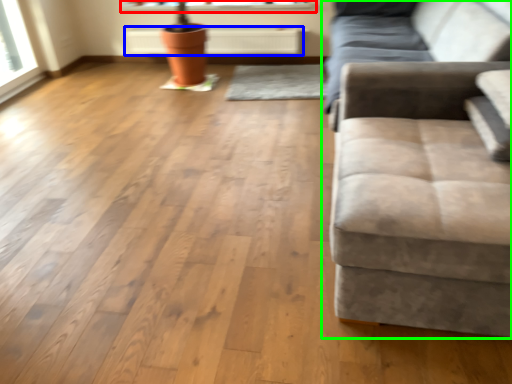
Question: Estimate the real-world distances between objects in this image. Which object is closer to window sill (highlighted by a red box), radiator (highlighted by a blue box) or studio couch (highlighted by a green box)?

Choices:
 (A) radiator
 (B) studio couch

Answer: (A)